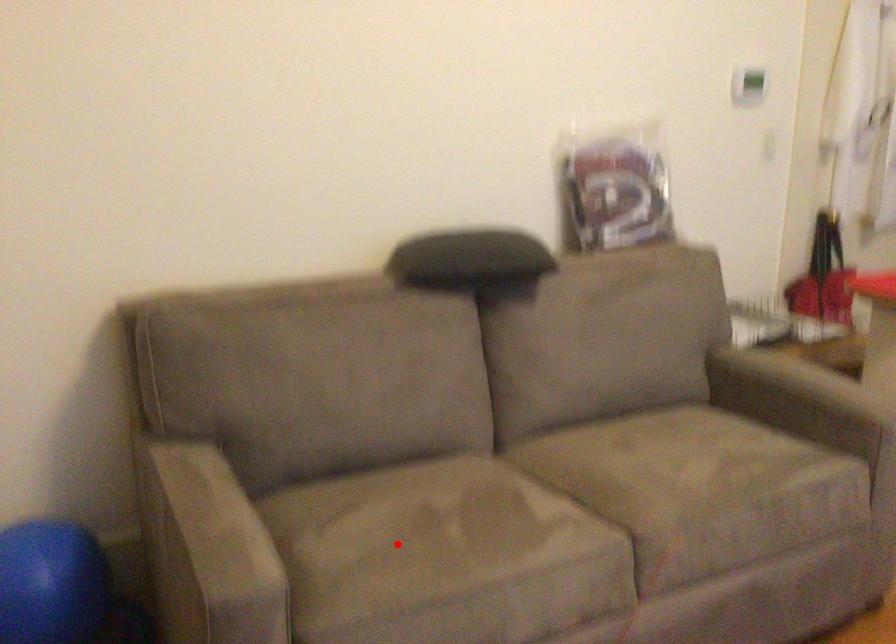
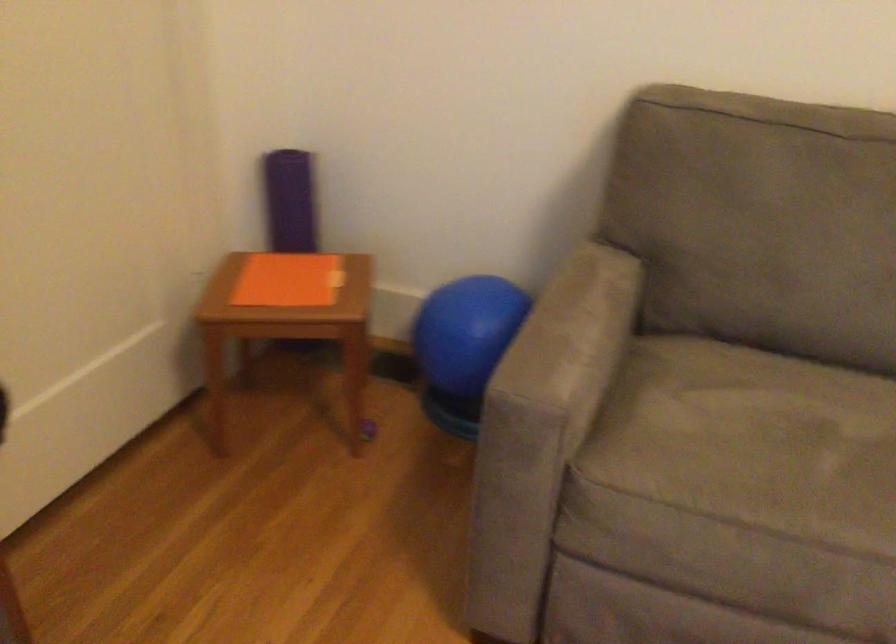
Question: A red point is marked in image1. In image2, is the corresponding 3D point closer to the camera or farther? Reply with the corresponding letter.

Choices:
 (A) The corresponding 3D point is closer.
 (B) The corresponding 3D point is farther.

Answer: (A)